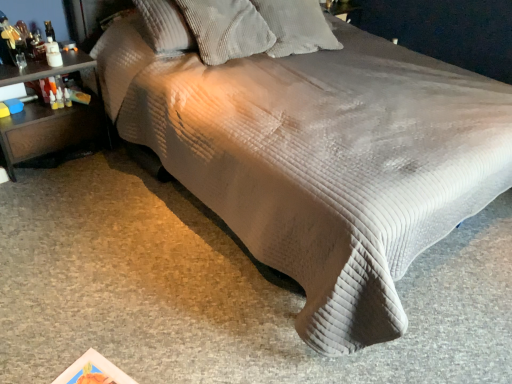
Question: Choose the correct answer: Is brown wood nightstand at left inside white corduroy pillow at upper center, which is counted as the 1th pillow, starting from the right, or outside it?

Choices:
 (A) outside
 (B) inside

Answer: (A)

Question: From the image's perspective, relative to white corduroy pillow at upper center, which is counted as the 1th pillow, starting from the right, is brown wood nightstand at left above or below?

Choices:
 (A) above
 (B) below

Answer: (B)

Question: Estimate the real-world distances between objects in this image. Which object is closer to the white corduroy pillow at upper center, which is counted as the 1th pillow, starting from the right?

Choices:
 (A) corduroy pillow at upper center, positioned as the first pillow in left-to-right order
 (B) brown wood nightstand at left

Answer: (A)

Question: Which object is positioned closest to the white corduroy pillow at upper center, marked as the second pillow in a left-to-right arrangement?

Choices:
 (A) brown wood nightstand at left
 (B) corduroy pillow at upper center, positioned as the first pillow in left-to-right order

Answer: (B)